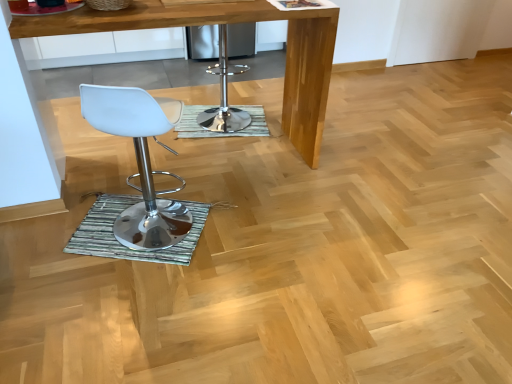
Identify the location of vacant area that lies to the right of wooden table at center. The image size is (512, 384). (359, 183).